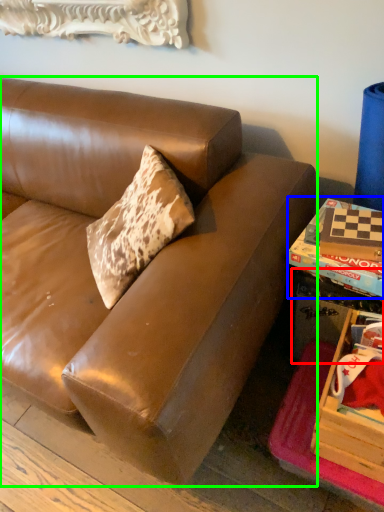
Question: Which is farther away from table (highlighted by a red box)? book (highlighted by a blue box) or studio couch (highlighted by a green box)?

Choices:
 (A) book
 (B) studio couch

Answer: (B)